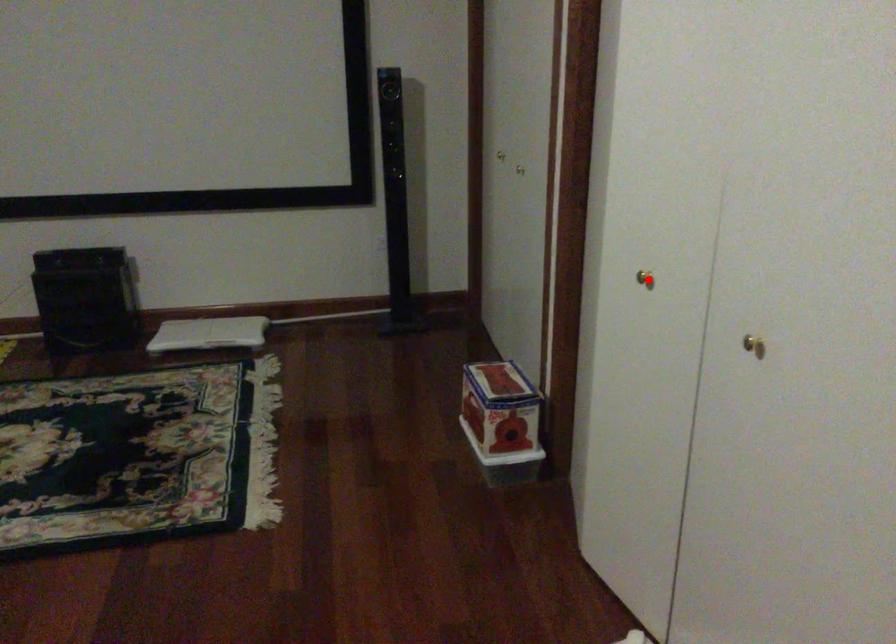
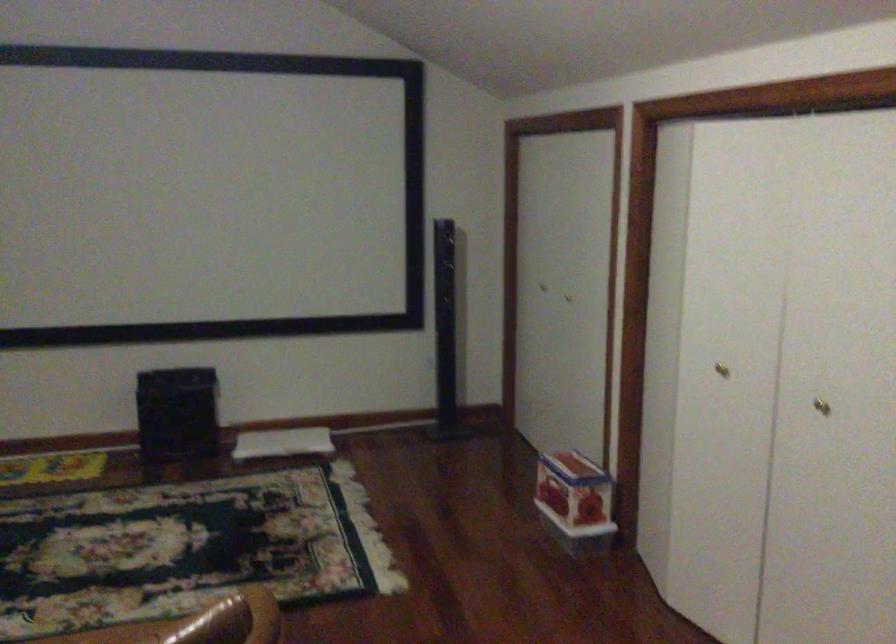
Question: A red point is marked in image1. In image2, is the corresponding 3D point closer to the camera or farther? Reply with the corresponding letter.

Choices:
 (A) The corresponding 3D point is closer.
 (B) The corresponding 3D point is farther.

Answer: (B)